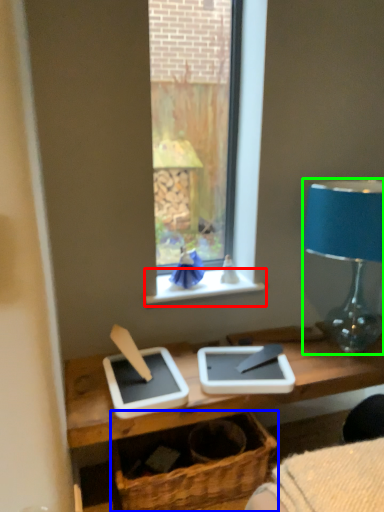
Question: Considering the real-world distances, which object is farthest from window sill (highlighted by a red box)? basket (highlighted by a blue box) or lamp (highlighted by a green box)?

Choices:
 (A) basket
 (B) lamp

Answer: (A)